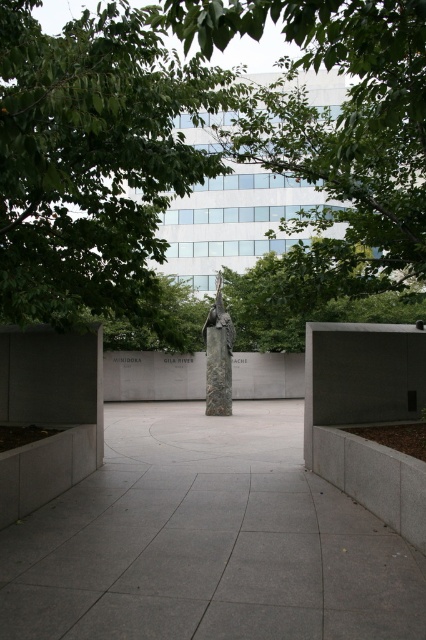
Question: Which point is farther to the camera?

Choices:
 (A) (408, 625)
 (B) (89, 22)
 (C) (218, 326)

Answer: (C)

Question: Is green leafy tree at center to the left of gray concrete pavement at center from the viewer's perspective?

Choices:
 (A) yes
 (B) no

Answer: (A)

Question: Is green leafy tree at center closer to camera compared to rustic stone sculpture at center?

Choices:
 (A) no
 (B) yes

Answer: (B)

Question: Observing the image, what is the correct spatial positioning of gray concrete pavement at center in reference to rustic stone sculpture at center?

Choices:
 (A) above
 (B) below

Answer: (B)

Question: Which object appears farthest from the camera in this image?

Choices:
 (A) green leafy tree at center
 (B) gray concrete pavement at center

Answer: (B)

Question: Which object appears farthest from the camera in this image?

Choices:
 (A) green leafy tree at center
 (B) gray concrete pavement at center

Answer: (B)